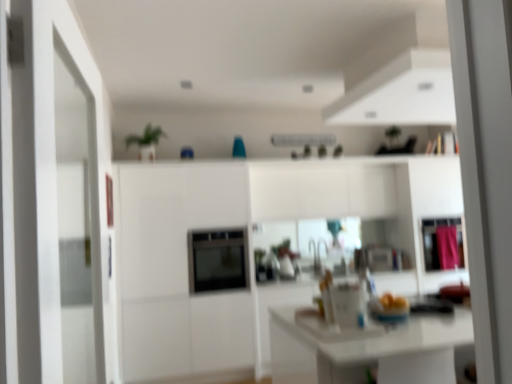
What is the approximate width of satin black oven at center?

satin black oven at center is 61.91 centimeters wide.

What do you see at coordinates (447, 247) in the screenshot?
I see `pink fabric curtain at right` at bounding box center [447, 247].

I want to click on satin black oven at center, so click(218, 260).

Can you see satin black oven at center touching pink fabric curtain at right?

No, satin black oven at center is not next to pink fabric curtain at right.

Considering the sizes of objects satin black oven at center and pink fabric curtain at right in the image provided, who is shorter, satin black oven at center or pink fabric curtain at right?

pink fabric curtain at right.

In the scene shown: Can you confirm if satin black oven at center is bigger than pink fabric curtain at right?

Indeed, satin black oven at center has a larger size compared to pink fabric curtain at right.

Does point (205, 286) appear closer or farther from the camera than point (452, 233)?

Point (205, 286) appears to be closer to the viewer than point (452, 233).

Is pink fabric curtain at right at the right side of satin black oven at center?

Correct, you'll find pink fabric curtain at right to the right of satin black oven at center.

Is satin black oven at center at the back of pink fabric curtain at right?

No.

Based on the photo, is pink fabric curtain at right wider or thinner than satin black oven at center?

Considering their sizes, pink fabric curtain at right looks slimmer than satin black oven at center.

Considering the relative sizes of pink fabric curtain at right and satin black oven at center in the image provided, is pink fabric curtain at right smaller than satin black oven at center?

Indeed, pink fabric curtain at right has a smaller size compared to satin black oven at center.

Can you confirm if pink fabric cabinet at right is thinner than pink fabric curtain at right?

No, pink fabric cabinet at right is not thinner than pink fabric curtain at right.

Consider the image. From their relative heights in the image, would you say pink fabric cabinet at right is taller or shorter than pink fabric curtain at right?

In the image, pink fabric cabinet at right appears to be taller than pink fabric curtain at right.

Is pink fabric cabinet at right facing away from pink fabric curtain at right?

Yes, pink fabric cabinet at right's orientation is away from pink fabric curtain at right.

From a real-world perspective, which is physically above, pink fabric cabinet at right or pink fabric curtain at right?

pink fabric cabinet at right.

Is point (451, 259) less distant than point (209, 252)?

No, it is behind (209, 252).

Is pink fabric cabinet at right not within satin black oven at center?

Absolutely, pink fabric cabinet at right is external to satin black oven at center.

The image size is (512, 384). I want to click on cabinetry behind the satin black oven at center, so click(x=443, y=243).

Considering the relative sizes of satin black oven at center and pink fabric cabinet at right in the image provided, is satin black oven at center wider than pink fabric cabinet at right?

Yes, satin black oven at center is wider than pink fabric cabinet at right.

Is satin black oven at center to the left or to the right of pink fabric cabinet at right in the image?

Based on their positions, satin black oven at center is located to the left of pink fabric cabinet at right.

Is point (216, 268) farther from camera compared to point (426, 268)?

No, (216, 268) is in front of (426, 268).

From a real-world perspective, is satin black oven at center positioned over pink fabric cabinet at right based on gravity?

No, from a real-world perspective, satin black oven at center is not above pink fabric cabinet at right.

Is pink fabric curtain at right oriented away from pink fabric cabinet at right?

Yes, pink fabric curtain at right's orientation is away from pink fabric cabinet at right.

From the image's perspective, does pink fabric curtain at right appear lower than pink fabric cabinet at right?

Correct, pink fabric curtain at right appears lower than pink fabric cabinet at right in the image.

Is pink fabric curtain at right located outside pink fabric cabinet at right?

Actually, pink fabric curtain at right is within pink fabric cabinet at right.

Identify the location of appliance on the left of the pink fabric curtain at right. Image resolution: width=512 pixels, height=384 pixels. (218, 260).

I want to click on curtain below the satin black oven at center (from a real-world perspective), so click(447, 247).

Based on their spatial positions, is pink fabric cabinet at right or pink fabric curtain at right closer to satin black oven at center?

Based on the image, pink fabric cabinet at right appears to be nearer to satin black oven at center.

Which object lies further to the anchor point pink fabric curtain at right, pink fabric cabinet at right or satin black oven at center?

satin black oven at center is further to pink fabric curtain at right.

Based on their spatial positions, is satin black oven at center or pink fabric curtain at right closer to pink fabric cabinet at right?

pink fabric curtain at right lies closer to pink fabric cabinet at right than the other object.

Looking at the image, which one is located closer to pink fabric cabinet at right, pink fabric curtain at right or satin black oven at center?

→ pink fabric curtain at right lies closer to pink fabric cabinet at right than the other object.

Which object lies nearer to the anchor point pink fabric curtain at right, satin black oven at center or pink fabric cabinet at right?

pink fabric cabinet at right.

From the picture: Which object lies further to the anchor point satin black oven at center, pink fabric curtain at right or pink fabric cabinet at right?

pink fabric curtain at right lies further to satin black oven at center than the other object.

The image size is (512, 384). In order to click on cabinetry situated between satin black oven at center and pink fabric curtain at right from left to right in this screenshot , I will do `click(443, 243)`.